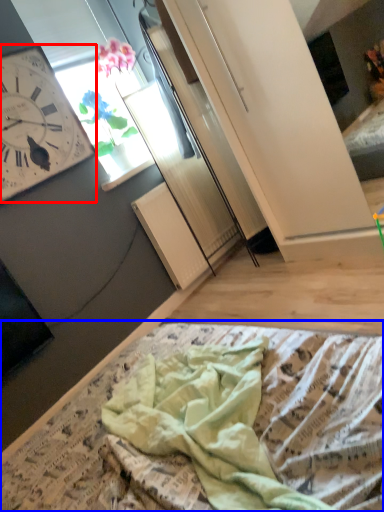
Question: Which object is further to the camera taking this photo, wall clock (highlighted by a red box) or blanket (highlighted by a blue box)?

Choices:
 (A) wall clock
 (B) blanket

Answer: (A)